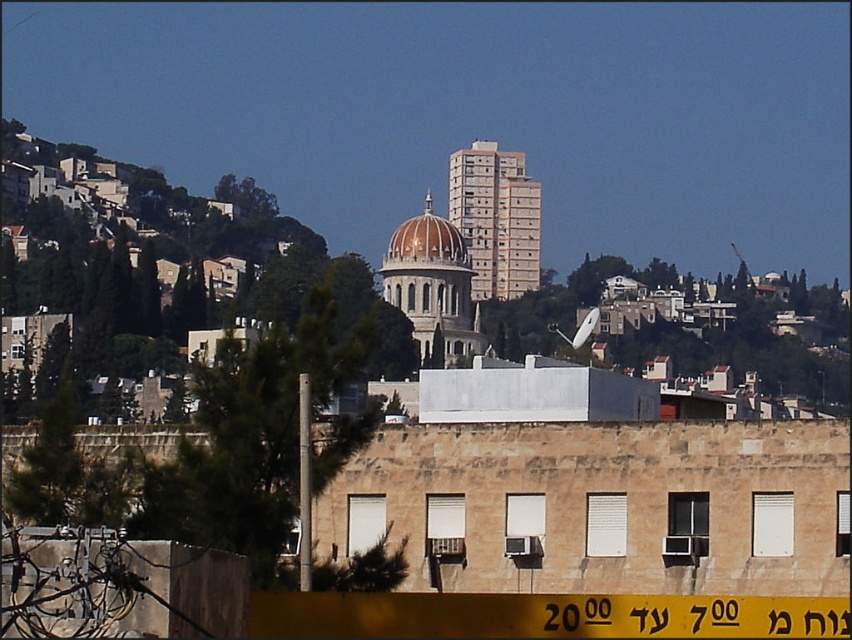
Question: Which point is farther to the camera?

Choices:
 (A) (384, 269)
 (B) (452, 275)
 (C) (519, 208)

Answer: (C)

Question: Which of the following is the farthest from the observer?

Choices:
 (A) (475, 253)
 (B) (389, 248)
 (C) (471, 339)

Answer: (A)

Question: Does beige concrete tower at center have a greater width compared to golden dome building at center?

Choices:
 (A) yes
 (B) no

Answer: (A)

Question: Which point is closer to the camera?

Choices:
 (A) (459, 256)
 (B) (494, 285)
 (C) (453, 262)

Answer: (C)

Question: Does golden dome building at center appear on the left side of golden glass dome at center?

Choices:
 (A) no
 (B) yes

Answer: (A)

Question: Observing the image, what is the correct spatial positioning of beige concrete tower at center in reference to golden dome building at center?

Choices:
 (A) right
 (B) left

Answer: (A)